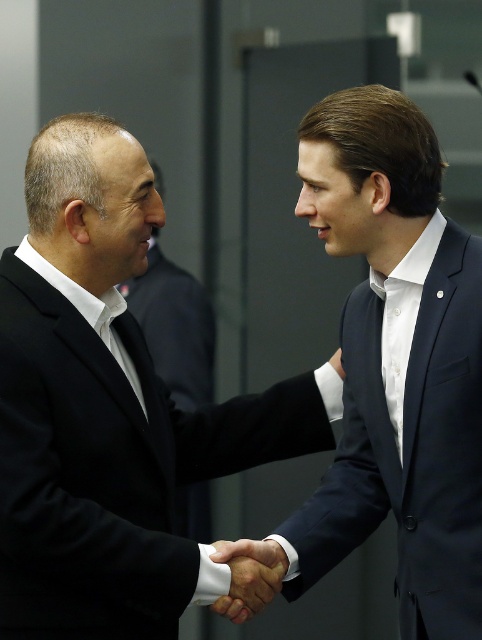
You are standing in the conference room and need to locate the navy blue suit at center. According to the coordinates provided, where exactly would you find it?

The navy blue suit at center is located at coordinates point 0.569 on the x axis and 0.824 on the y axis.

You are a photographer adjusting the camera settings to focus on the black matte suit at left. What are the coordinates you should set to ensure proper focus?

The coordinates to focus on the black matte suit at left are point (109, 410).

You are a photographer adjusting the focus of your camera. The black matte suit at left and the smooth skin handshake at center are in the frame. Can you focus on both objects simultaneously if your camera has a depth of field that can cover 14 inches?

The black matte suit at left is 13.63 inches from smooth skin handshake at center. Since the distance between them is less than 14 inches, the camera can focus on both objects simultaneously.